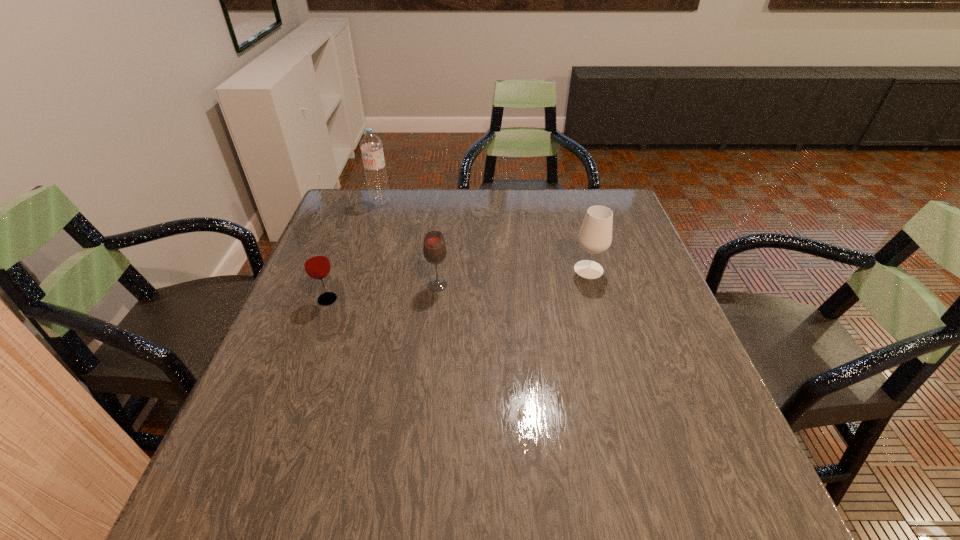
Where is `water bottle`? The width and height of the screenshot is (960, 540). water bottle is located at coordinates (371, 146).

Find the location of `the tallest object`. the tallest object is located at coordinates (371, 146).

Find the location of `the rightmost glass`. the rightmost glass is located at coordinates (595, 236).

The height and width of the screenshot is (540, 960). Identify the location of the second glass from right to left. (434, 248).

This screenshot has height=540, width=960. Identify the location of the leftmost glass. (316, 263).

At what (x,y) coordinates should I click in order to perform the action: click on vacant space located 0.220m on the front of the water bottle. Please return your answer as a coordinate pair (x, y). The image size is (960, 540). Looking at the image, I should click on (365, 249).

The image size is (960, 540). Find the location of `blank space located 0.210m on the back of the rightmost object`. blank space located 0.210m on the back of the rightmost object is located at coordinates (573, 217).

I want to click on free space located on the front of the third object from left to right, so click(x=435, y=313).

You are a GUI agent. You are given a task and a screenshot of the screen. Output one action in this format:
    pyautogui.click(x=<x>, y=<y>)
    Task: Click on the vacant space located on the front of the leftmost glass
    The image size is (960, 540).
    Given the screenshot: What is the action you would take?
    pyautogui.click(x=285, y=411)

Identify the location of object at the far edge. (371, 146).